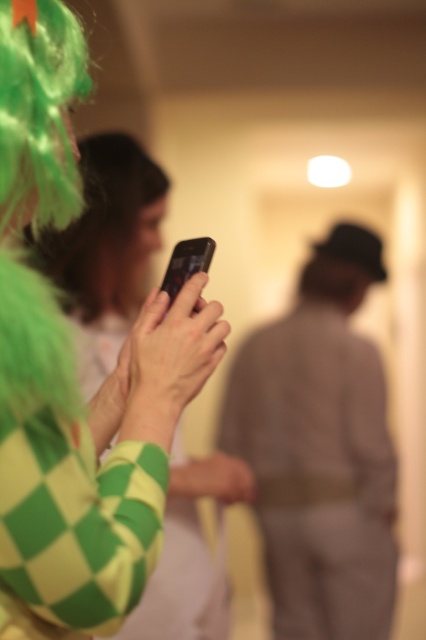
You are a photographer who needs to adjust the distance between the light brown fabric suit at center and the camera to ensure proper focus. The current distance is 2.33 meters. According to the scene description, is this distance sufficient for a clear photo?

The light brown fabric suit at center and camera are 2.33 meters apart. This distance is sufficient for a clear photo as most cameras can focus effectively at this range.

Based on the scene description, where is the light brown fabric suit at center located in terms of coordinates?

The light brown fabric suit at center is located at point (321, 451).

You are standing at the point with coordinates point (78, 529) and want to move towards the point (322, 378). Which direction should you move in?

Since point (322, 378) is further to the camera than point (78, 529), you should move forward towards the point (322, 378).